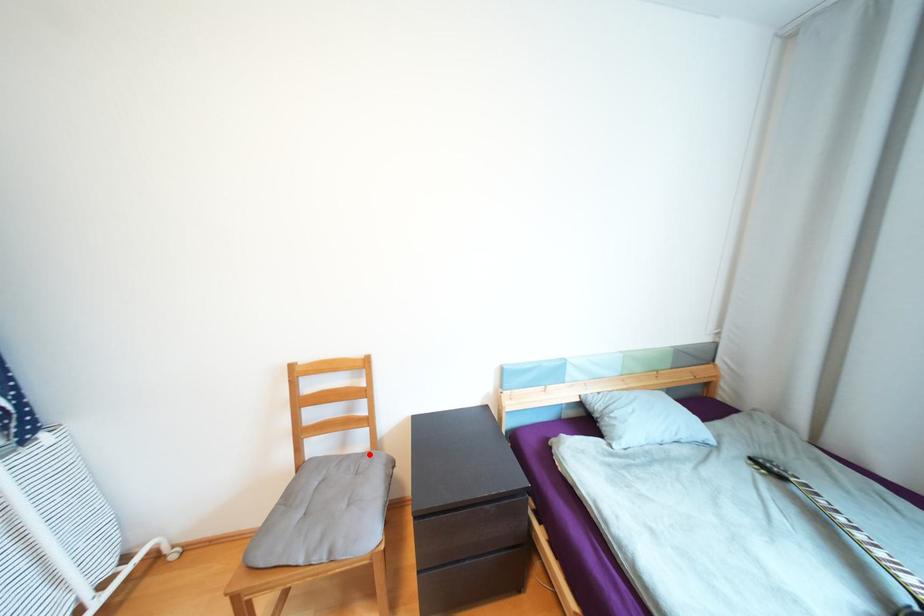
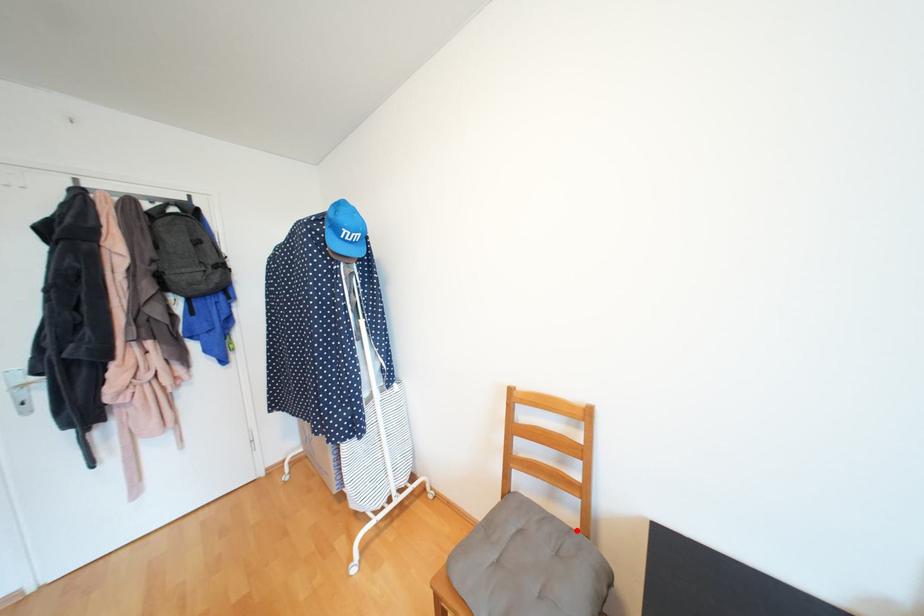
I am providing you with two images of the same scene from different viewpoints. A red point is marked on the first image and another point is marked on the second image. Is the red point in image1 aligned with the point shown in image2?

Yes